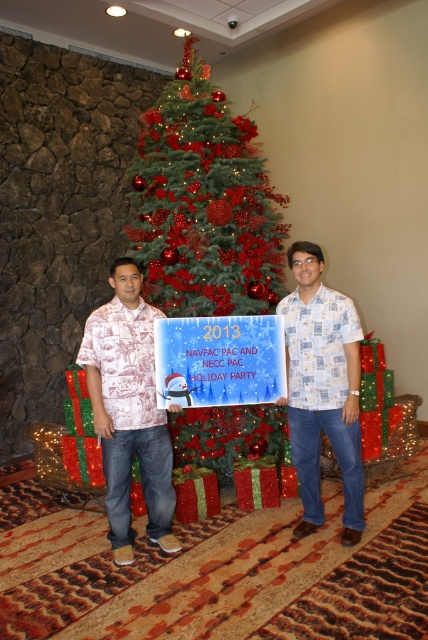
Is point (171, 294) behind point (315, 376)?

Yes.

Between green textured christmas tree at center and white printed shirt at center, which one appears on the left side from the viewer's perspective?

From the viewer's perspective, green textured christmas tree at center appears more on the left side.

What do you see at coordinates (204, 204) in the screenshot?
I see `green textured christmas tree at center` at bounding box center [204, 204].

Identify the location of green textured christmas tree at center. The image size is (428, 640). (204, 204).

Can you confirm if green textured christmas tree at center is smaller than printed cotton shirt at center?

No.

Is point (187, 92) closer to camera compared to point (112, 394)?

No.

In order to click on green textured christmas tree at center in this screenshot , I will do `click(204, 204)`.

Who is higher up, white printed shirt at center or white printed sign at center?

white printed shirt at center

Which is in front, point (291, 346) or point (300, 435)?

Point (291, 346) is more forward.

Is point (329, 417) positioned before point (113, 525)?

That is True.

At what (x,y) coordinates should I click in order to perform the action: click on white printed shirt at center. Please return your answer as a coordinate pair (x, y). Image resolution: width=428 pixels, height=640 pixels. Looking at the image, I should click on (323, 388).